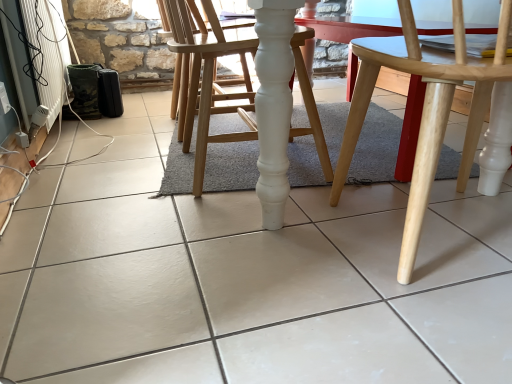
In order to click on vacant space underneath natural wood chair at center, the second chair from the left (from a real-world perspective) in this screenshot , I will do `click(448, 237)`.